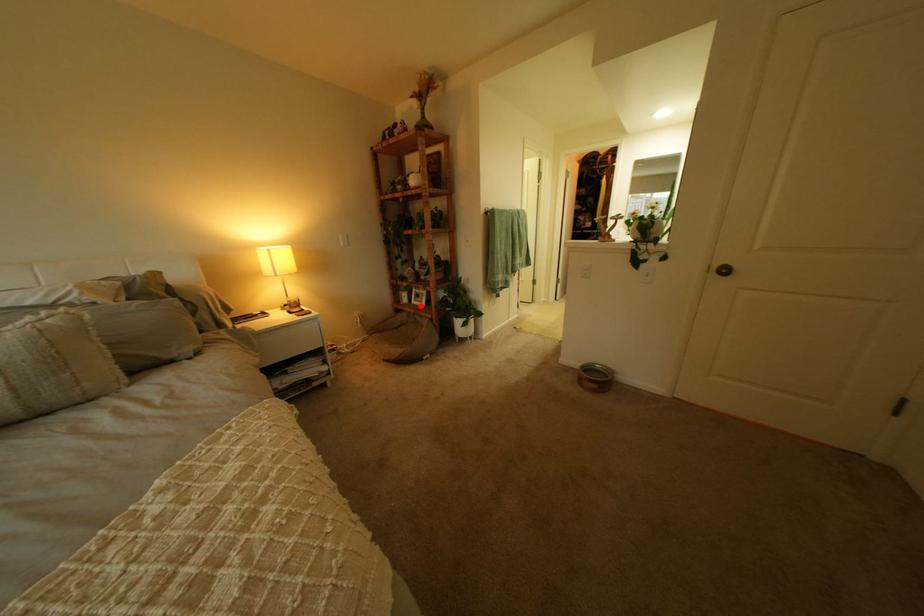
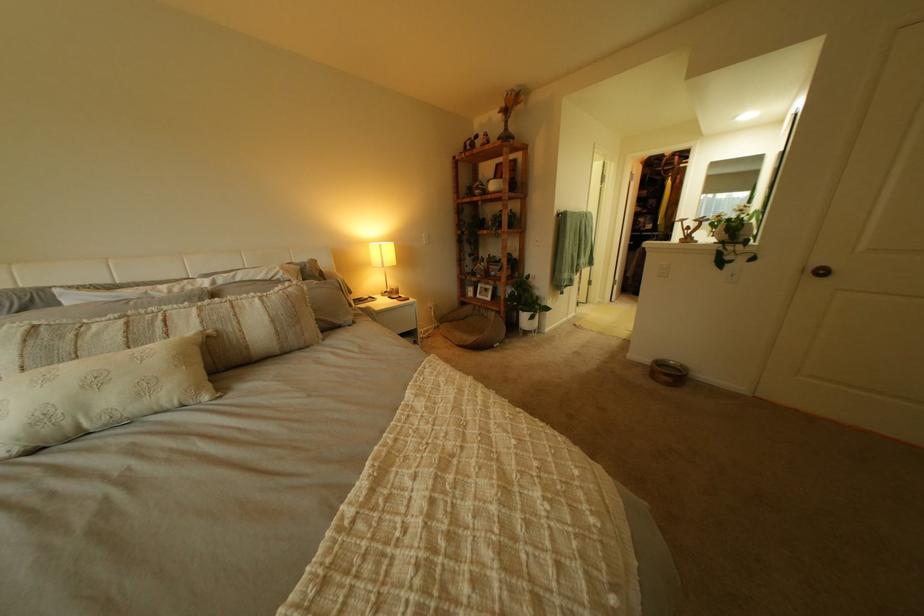
Locate, in the second image, the point that corresponds to the highlighted location in the first image.

(485, 300)